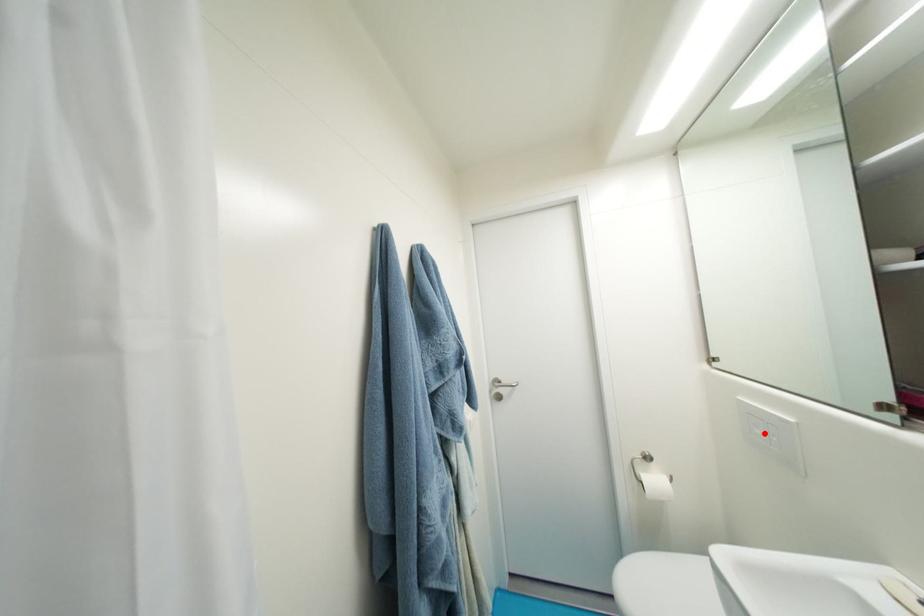
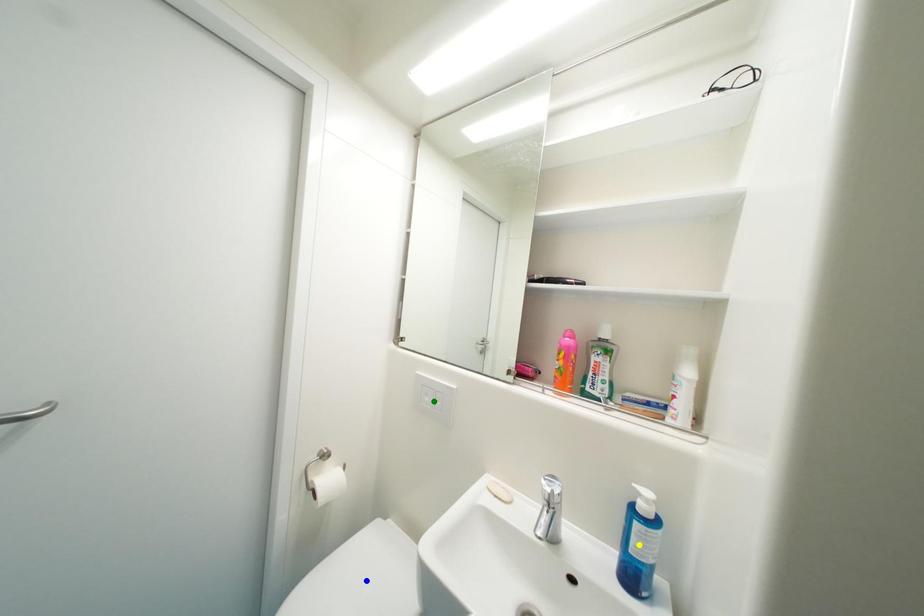
Question: I am providing you with two images of the same scene from different viewpoints. A red point is marked on the first image. You are given multiple points on the second image. Which mark in image 2 goes with the point in image 1?

Choices:
 (A) yellow point
 (B) green point
 (C) blue point

Answer: (B)